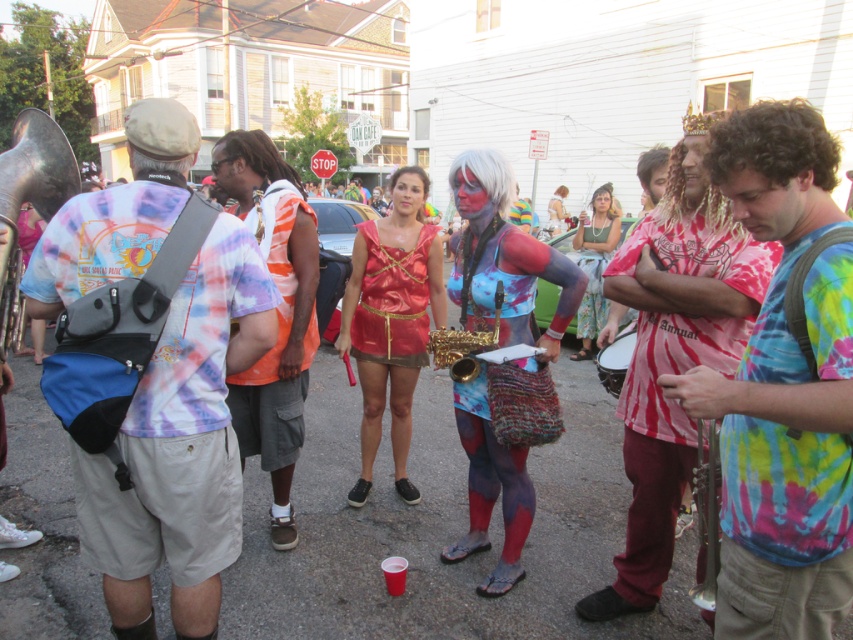
Question: Which of the following is the farthest from the observer?

Choices:
 (A) brass tuba at left
 (B) tie-dye fabric body paint at center
 (C) tie-dye fabric backpack at right
 (D) matte orange tank top at center

Answer: (A)

Question: Can you confirm if tie-dye fabric backpack at left is positioned to the left of gold shiny saxophone at center?

Choices:
 (A) no
 (B) yes

Answer: (B)

Question: Which point is farther to the camera?

Choices:
 (A) floral fabric dress at center
 (B) shiny red dress at center

Answer: (A)

Question: Is floral fabric dress at center further to camera compared to matte pink body paint at center?

Choices:
 (A) no
 (B) yes

Answer: (A)

Question: Based on their relative distances, which object is farther from the tie-dye fabric backpack at right?

Choices:
 (A) red tie-dye shirt at center
 (B) matte pink body paint at center
 (C) tie-dye fabric backpack at left
 (D) matte orange tank top at center

Answer: (B)

Question: Does tie-dye fabric backpack at left have a smaller size compared to silver metallic trombone at lower right?

Choices:
 (A) no
 (B) yes

Answer: (A)